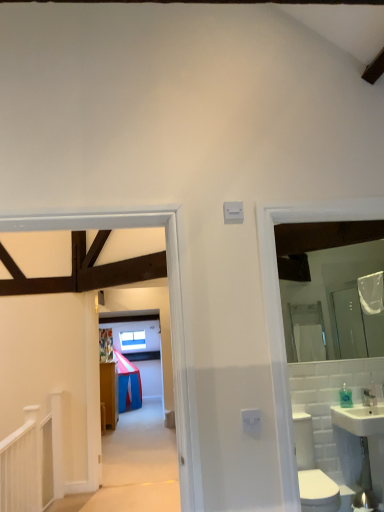
Question: Looking at their shapes, would you say clear plastic bottle at right is wider or thinner than clear glass mirror at right?

Choices:
 (A) thin
 (B) wide

Answer: (B)

Question: From a real-world perspective, is clear plastic bottle at right above or below clear glass mirror at right?

Choices:
 (A) above
 (B) below

Answer: (B)

Question: Which object is the closest to the transparent glass window at upper center?

Choices:
 (A) white ceramic sink at right
 (B) clear glass mirror at right
 (C) white glossy toilet bowl at lower right
 (D) wooden floorboards at center
 (E) clear plastic bottle at right

Answer: (E)

Question: Which is farther from the clear plastic bottle at right?

Choices:
 (A) clear glass mirror at right
 (B) transparent glass window at upper center
 (C) white ceramic sink at right
 (D) wooden floorboards at center
 (E) white glossy toilet bowl at lower right

Answer: (B)